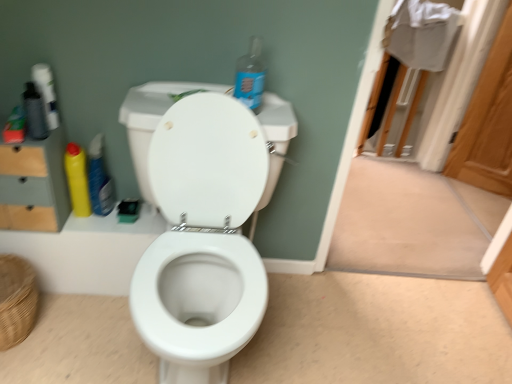
At what (x,y) coordinates should I click in order to perform the action: click on vacant area that lies to the right of white glossy toilet at center. Please return your answer as a coordinate pair (x, y). Looking at the image, I should click on (335, 333).